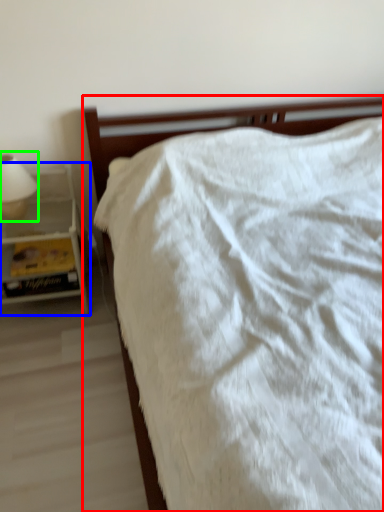
Question: Which is farther away from bed (highlighted by a red box)? nightstand (highlighted by a blue box) or bedside lamp (highlighted by a green box)?

Choices:
 (A) nightstand
 (B) bedside lamp

Answer: (B)